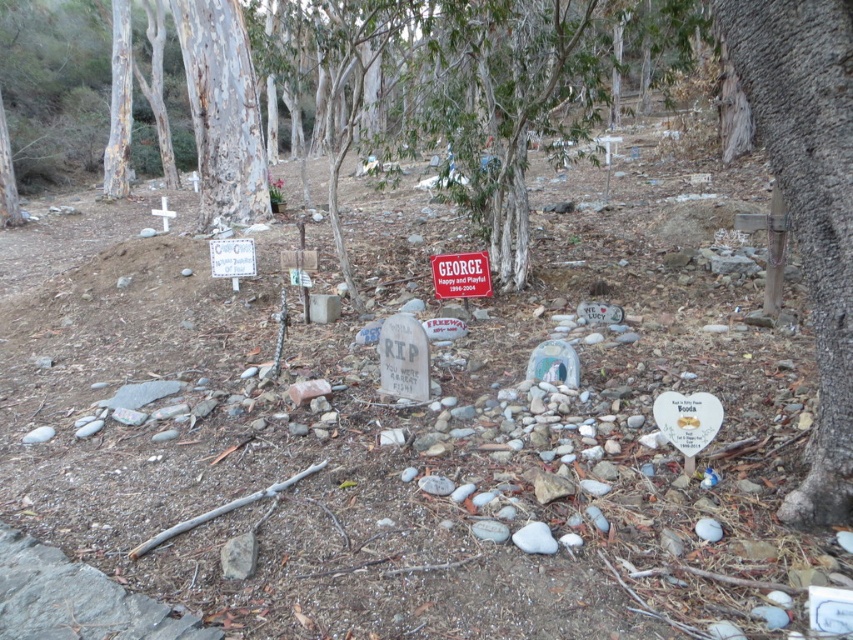
You are a photographer trying to capture the memorial scene. You want to ensure both the rip paper tombstone at center and the red plastic sign at center are clearly visible in your photo. Which object should you focus on first to ensure it stands out more in the frame?

The rip paper tombstone at center is much taller than the red plastic sign at center, so focusing on it first will ensure its prominence in the photo.

You are standing at the center of the memorial and see a point marked at coordinates (119, 104). Which object is this point located on?

The point marked at coordinates (119, 104) is located on the smooth bark tree at upper left.